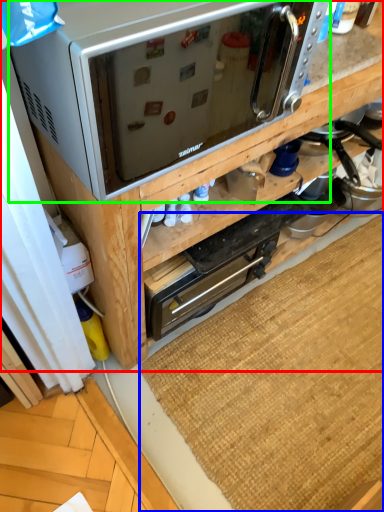
Question: Based on their relative distances, which object is farther from cabinetry (highlighted by a red box)? Choose from doormat (highlighted by a blue box) and microwave oven (highlighted by a green box).

Choices:
 (A) doormat
 (B) microwave oven

Answer: (A)